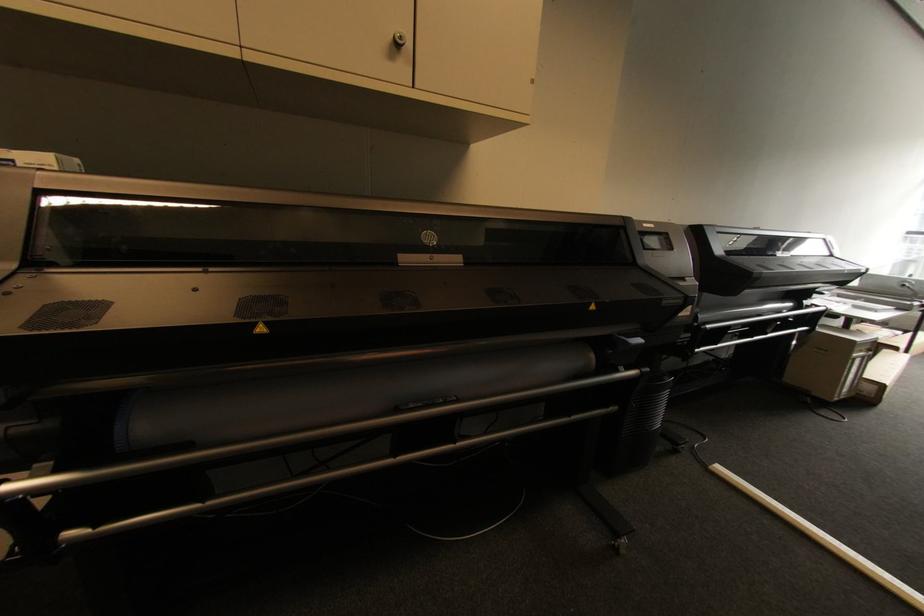
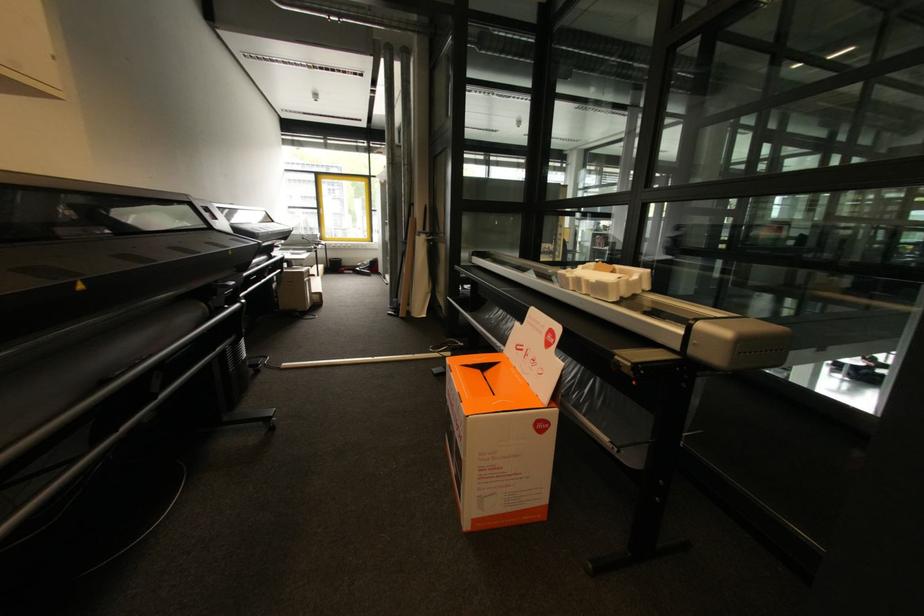
Where in the second image is the point corresponding to point 773,246 from the first image?

(245, 217)